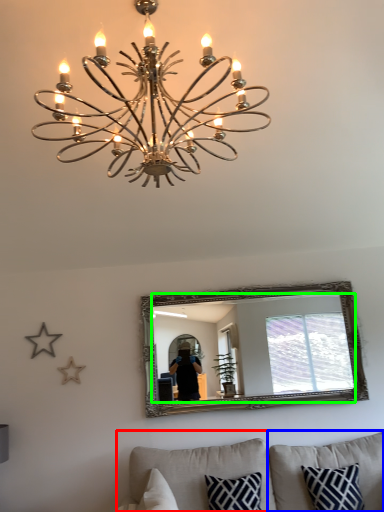
Question: Based on their relative distances, which object is farther from studio couch (highlighted by a red box)? Choose from pillow (highlighted by a blue box) and mirror (highlighted by a green box).

Choices:
 (A) pillow
 (B) mirror

Answer: (B)